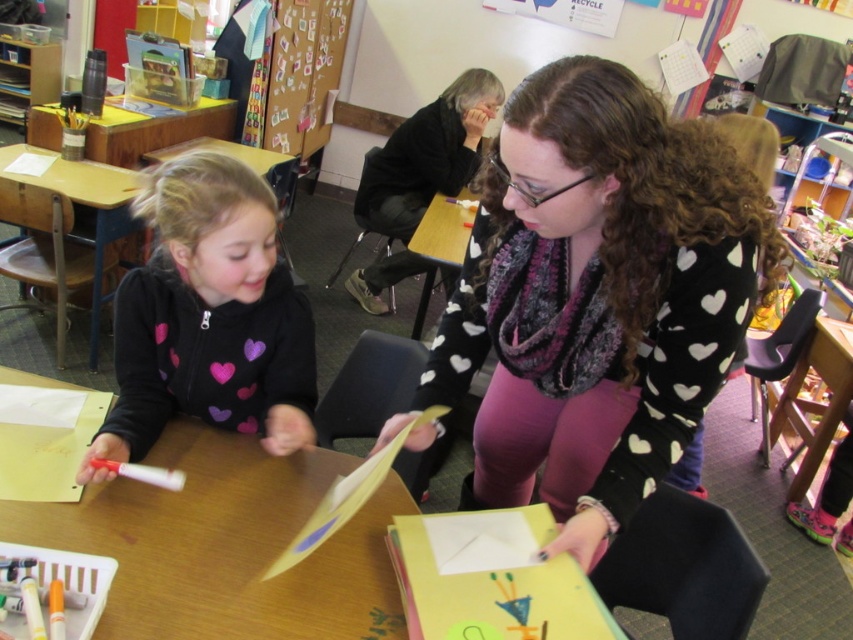
Question: Which object appears farthest from the camera in this image?

Choices:
 (A) wooden desk at left
 (B) wooden desk at upper left

Answer: (B)

Question: Which point is closer to the camera?

Choices:
 (A) wooden desk at left
 (B) black heart-patterned sweater at left

Answer: (B)

Question: Is black heart-patterned sweater at center to the right of wooden desk at upper left from the viewer's perspective?

Choices:
 (A) no
 (B) yes

Answer: (B)

Question: From the image, what is the correct spatial relationship of wooden desk at upper left in relation to wooden table at center?

Choices:
 (A) below
 (B) above

Answer: (B)

Question: Which point is farther to the camera?

Choices:
 (A) (434, 148)
 (B) (219, 125)
 (C) (450, 266)
 (D) (251, 369)

Answer: (B)

Question: Can you confirm if black heart-patterned sweater at center is smaller than wooden table at center?

Choices:
 (A) yes
 (B) no

Answer: (B)